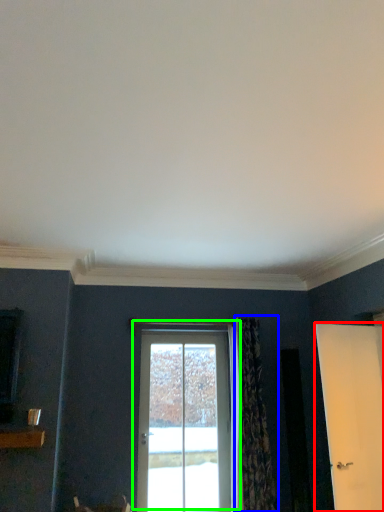
Question: Estimate the real-world distances between objects in this image. Which object is closer to door (highlighted by a red box), curtain (highlighted by a blue box) or door (highlighted by a green box)?

Choices:
 (A) curtain
 (B) door

Answer: (A)